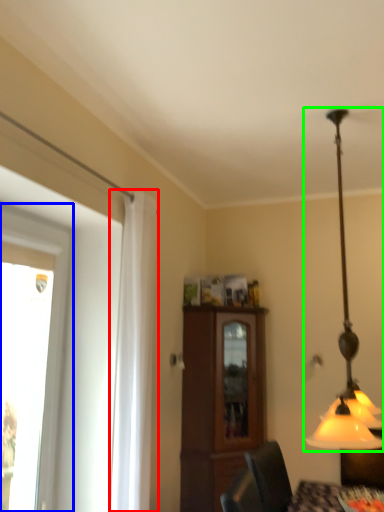
Question: Estimate the real-world distances between objects in this image. Which object is closer to curtain (highlighted by a red box), window (highlighted by a blue box) or lamp (highlighted by a green box)?

Choices:
 (A) window
 (B) lamp

Answer: (A)